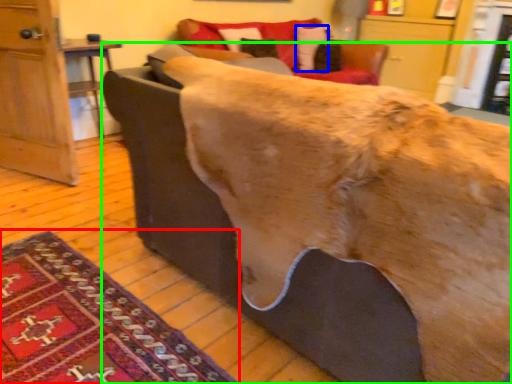
Question: Estimate the real-world distances between objects in this image. Which object is farther from mat (highlighted by a red box), pillow (highlighted by a blue box) or furniture (highlighted by a green box)?

Choices:
 (A) pillow
 (B) furniture

Answer: (A)